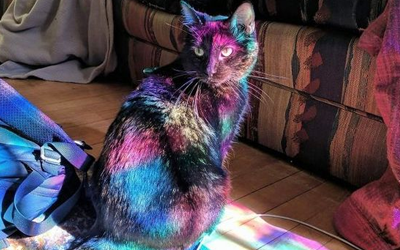
Identify the location of sofa. (315, 49).